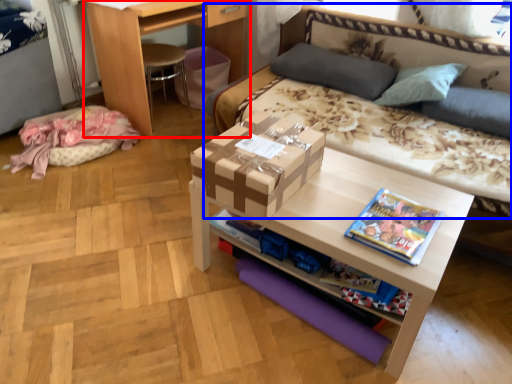
Question: Which of the following is the closest to the observer, desk (highlighted by a red box) or studio couch (highlighted by a blue box)?

Choices:
 (A) desk
 (B) studio couch

Answer: (B)